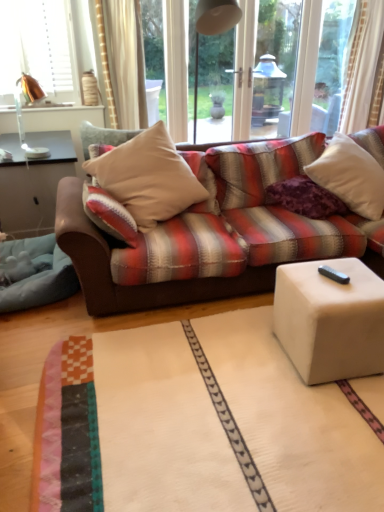
The width and height of the screenshot is (384, 512). Find the location of `blank space situated above white matte cube at lower right (from a real-world perspective)`. blank space situated above white matte cube at lower right (from a real-world perspective) is located at coordinates (334, 278).